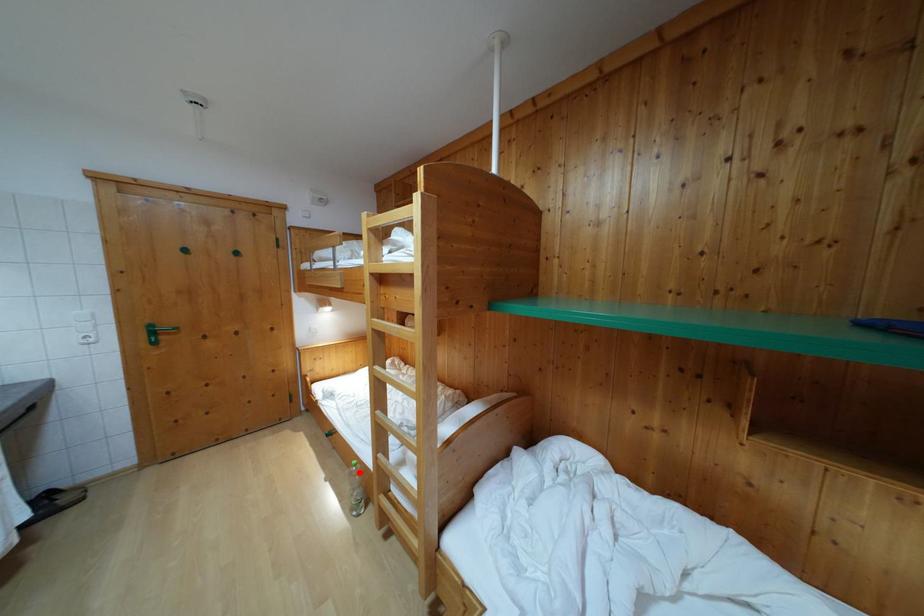
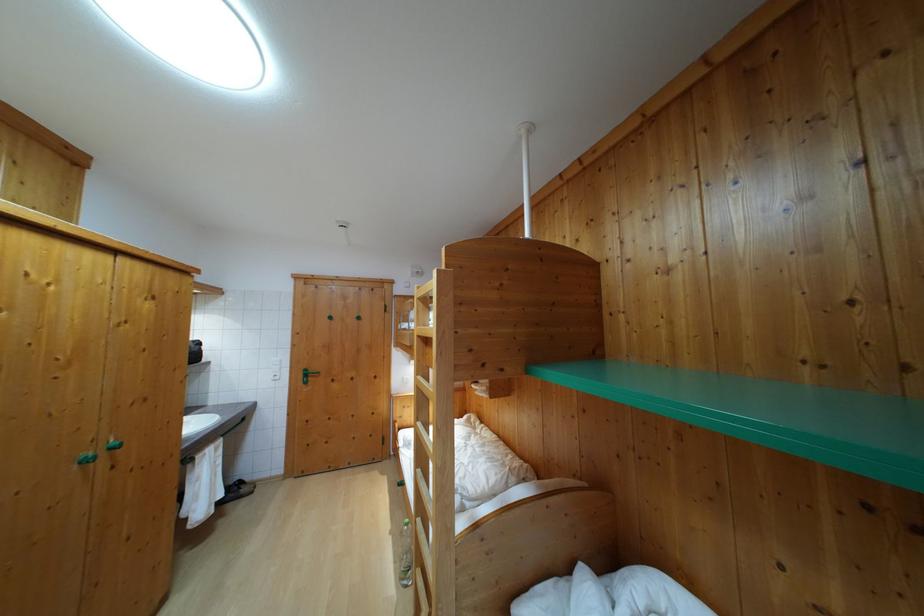
Question: I am providing you with two images of the same scene from different viewpoints. In image1, a red point is highlighted. Considering the same 3D point in image2, which of the following is correct?

Choices:
 (A) It is closer
 (B) It is farther

Answer: (A)